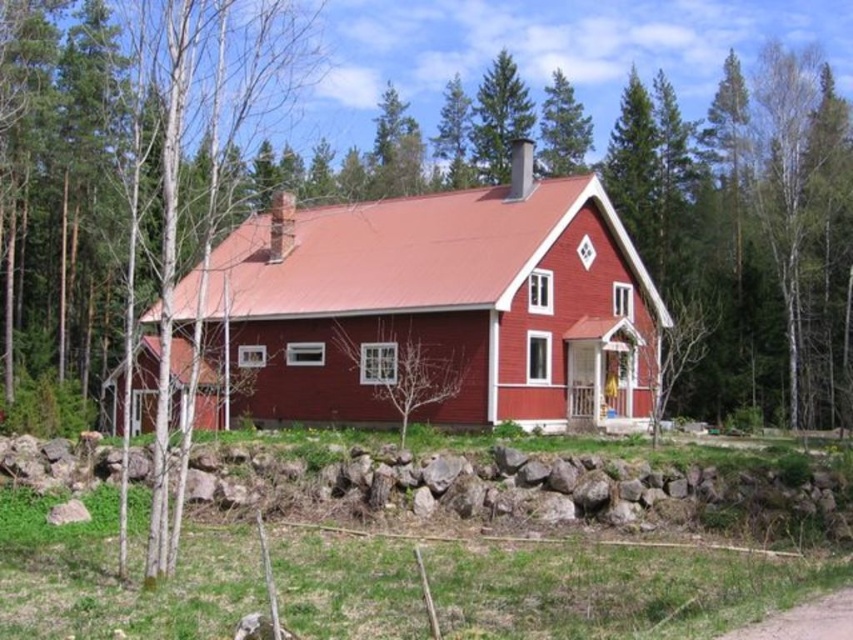
Based on the photo, you are standing in front of the red house and want to take a photo of the matte red barn at center and the green textured pine tree at upper center. Which object will appear larger in the photo?

The matte red barn at center will appear larger in the photo because it is closer to you than the green textured pine tree at upper center.

You are planning to build a new shed in your backyard and want to ensure it fits within the available space. You have a shed design that requires a width of 3 meters. Based on the image, can the matte red barn at center accommodate this width if the green textured pine tree at upper center is already occupying part of the space?

The matte red barn at center might be wider than the green textured pine tree at upper center, so it could potentially accommodate a 3 meter wide shed, but you should verify the exact measurements to ensure there is enough space.

You are standing in front of the red house and want to walk towards the matte red barn at center. Which direction should you walk relative to the bare wood tree at center?

Since the bare wood tree at center is to the right of the matte red barn at center, you should walk to the left of the bare wood tree at center to reach the matte red barn at center.